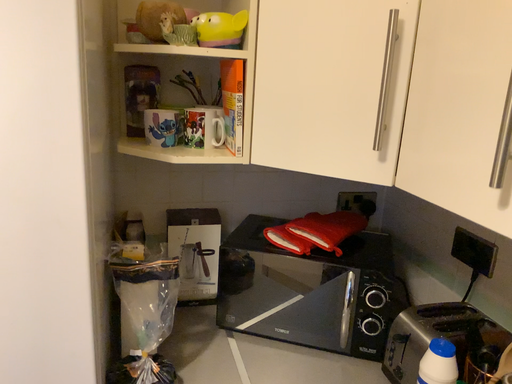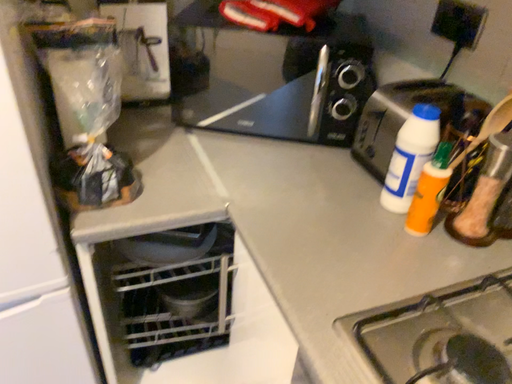
Question: How did the camera likely rotate when shooting the video?

Choices:
 (A) rotated downward
 (B) rotated upward

Answer: (A)